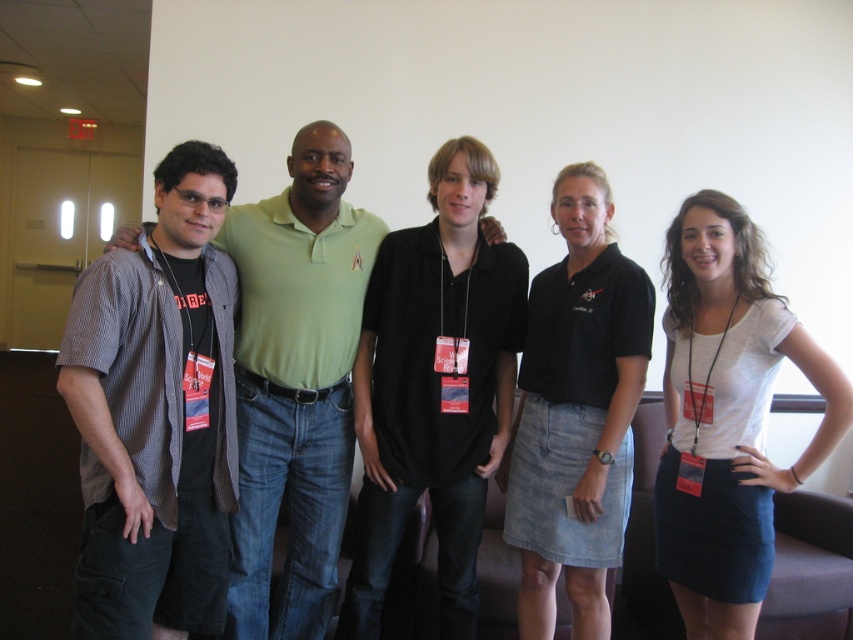
You are a photographer who needs to adjust the lighting to ensure both the checkered fabric shirt at left and the checkered fabric shirt at center are equally visible. Given their size difference, which shirt might require more light adjustment?

The checkered fabric shirt at left is larger in size than the checkered fabric shirt at center. Therefore, the larger shirt at left may need more light adjustment to ensure it doesn not overpower the smaller one in visibility.